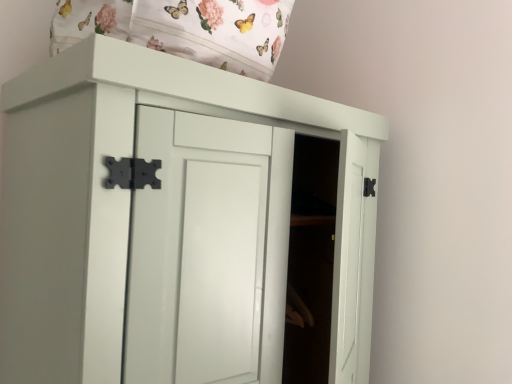
Looking at this image, what is the approximate height of white glossy cupboard at center?

39.29 inches.

At what (x,y) coordinates should I click in order to perform the action: click on white glossy cupboard at center. Please return your answer as a coordinate pair (x, y). The width and height of the screenshot is (512, 384). Looking at the image, I should click on (133, 127).

Describe the element at coordinates (133, 127) in the screenshot. I see `white glossy cupboard at center` at that location.

The width and height of the screenshot is (512, 384). I want to click on white glossy cupboard at center, so click(x=133, y=127).